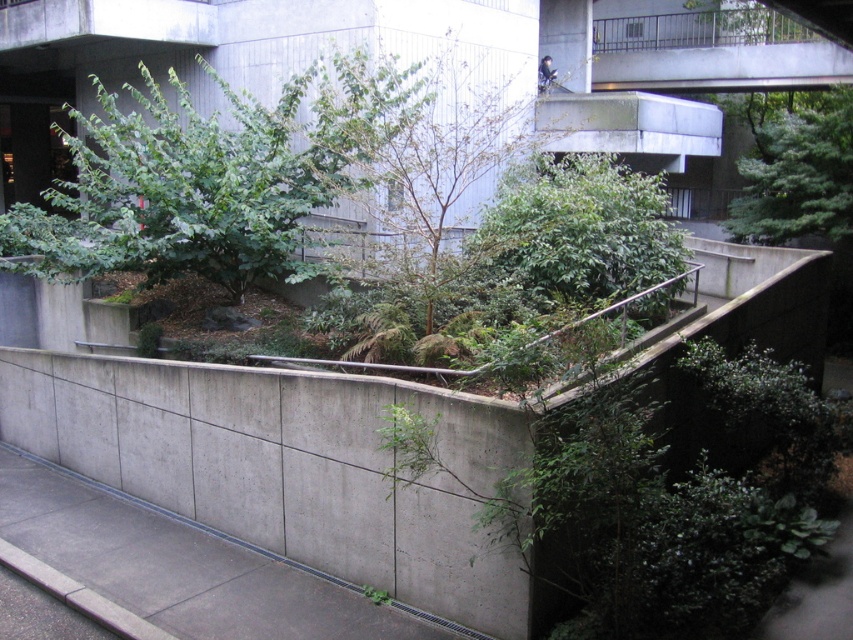
Is point (74, 273) in front of point (711, 74)?

Yes, point (74, 273) is closer to viewer.

Between green leafy tree at upper left and concrete railing at upper right, which one has less height?

green leafy tree at upper left

This screenshot has height=640, width=853. Identify the location of green leafy tree at upper left. (210, 176).

I want to click on green leafy tree at upper left, so (210, 176).

What do you see at coordinates (292, 468) in the screenshot? I see `concrete at center` at bounding box center [292, 468].

Can you confirm if concrete at center is smaller than green leafy bush at center?

Correct, concrete at center occupies less space than green leafy bush at center.

Where is `concrete at center`? This screenshot has width=853, height=640. concrete at center is located at coordinates (292, 468).

Measure the distance between point (x=770, y=83) and camera.

Point (x=770, y=83) and camera are 16.93 meters apart.

Is concrete railing at upper right to the left of green textured tree at upper right from the viewer's perspective?

Yes, concrete railing at upper right is to the left of green textured tree at upper right.

Identify the location of concrete railing at upper right. (712, 52).